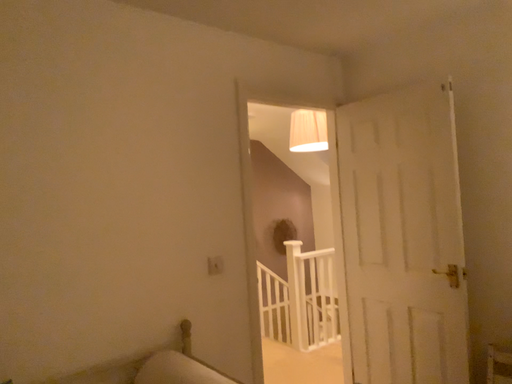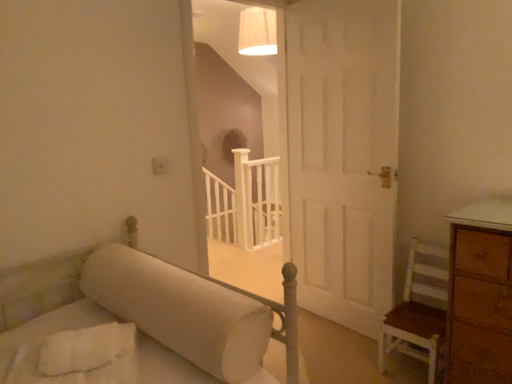
Question: Which way did the camera rotate in the video?

Choices:
 (A) rotated left
 (B) rotated right

Answer: (B)